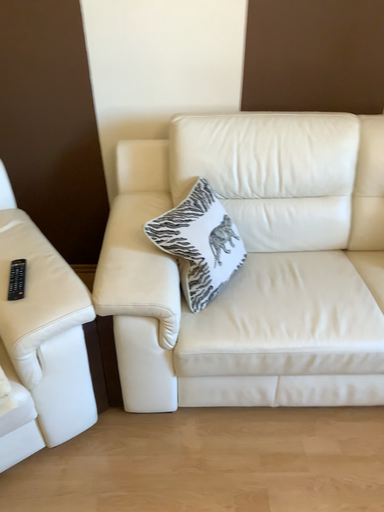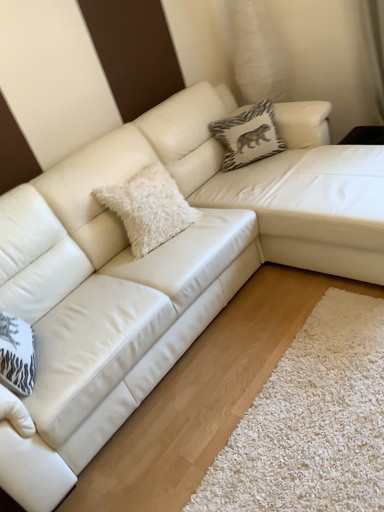
Question: Which way did the camera rotate in the video?

Choices:
 (A) rotated left
 (B) rotated right

Answer: (B)